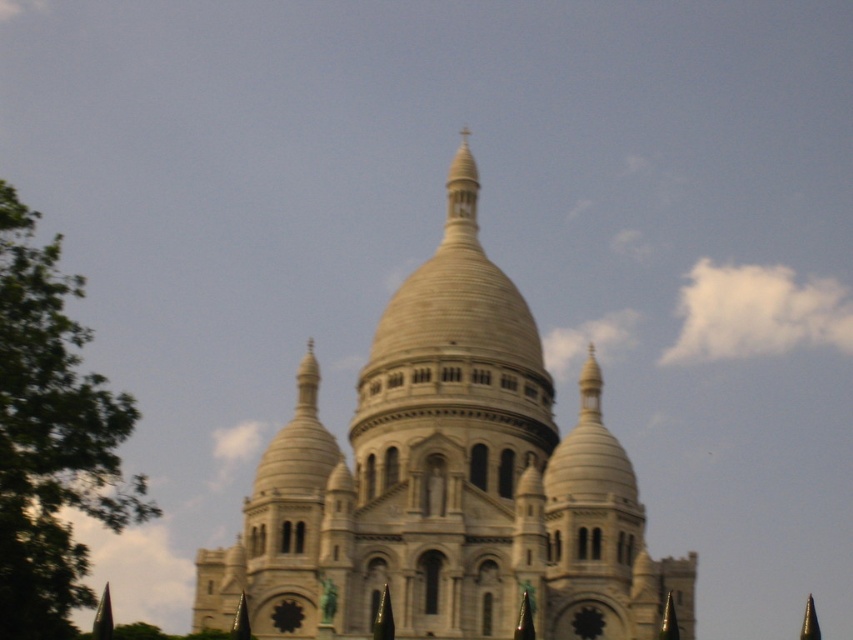
Question: Is white stone church at center below green leafy tree at left?

Choices:
 (A) no
 (B) yes

Answer: (B)

Question: Among these objects, which one is farthest from the camera?

Choices:
 (A) white stone church at center
 (B) green leafy tree at left

Answer: (A)

Question: Can you confirm if white stone church at center is bigger than green leafy tree at left?

Choices:
 (A) yes
 (B) no

Answer: (A)

Question: Is white stone church at center to the right of green leafy tree at left from the viewer's perspective?

Choices:
 (A) no
 (B) yes

Answer: (B)

Question: Which point is farther to the camera?

Choices:
 (A) white stone church at center
 (B) green leafy tree at left

Answer: (A)